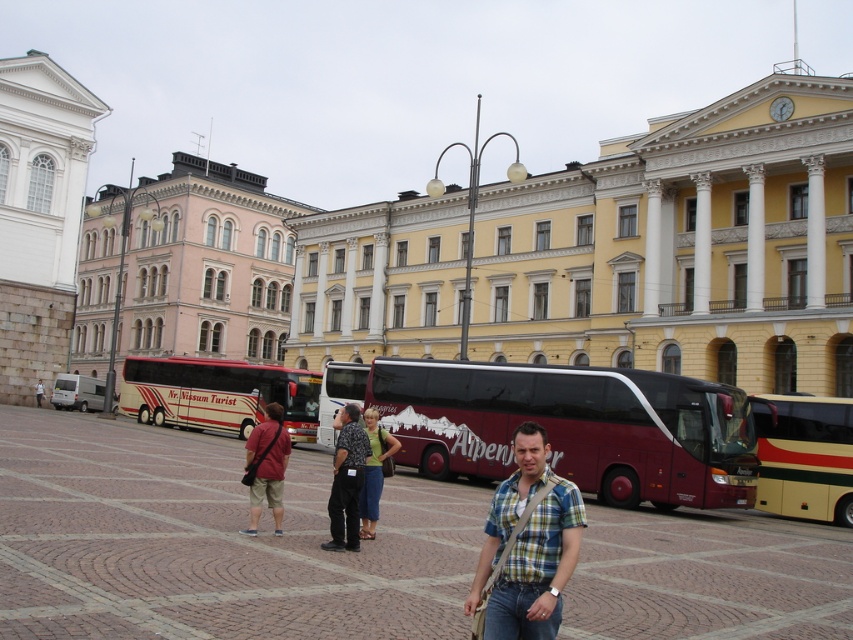
You are standing in the public square and want to take a photo of the white stone building at upper left. Where should you position yourself to capture it in the frame?

To capture the white stone building at upper left in your photo, position yourself at point (39, 216).

You are standing in the plaza and want to take a photo of both the maroon and cream tour bus labeled Alpen and the yellow building with white columns. You notice two points marked in the image at coordinates point (73, 164) and point (274, 488). Which point should you stand closer to in order to frame both the tour bus and the yellow building in your photo without moving the camera?

You should stand closer to point (73, 164) because it is closer to the camera, allowing you to capture both the maroon and cream tour bus labeled Alpen and the yellow building with white columns in the frame without moving the camera.